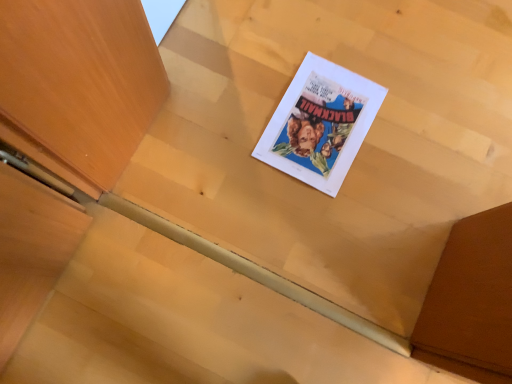
In order to face white paper poster at center, should I rotate leftwards or rightwards?

You should rotate right by 8.978 degrees.

What do you see at coordinates (320, 124) in the screenshot? The height and width of the screenshot is (384, 512). I see `white paper poster at center` at bounding box center [320, 124].

Identify the location of white paper poster at center. This screenshot has height=384, width=512. (320, 124).

You are a GUI agent. You are given a task and a screenshot of the screen. Output one action in this format:
    pyautogui.click(x=<x>, y=<y>)
    Task: Click on the white paper poster at center
    The height and width of the screenshot is (384, 512).
    Given the screenshot: What is the action you would take?
    (x=320, y=124)